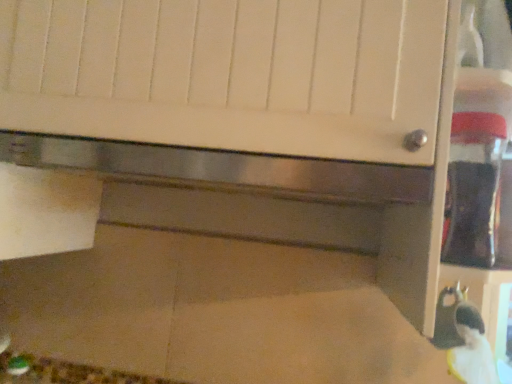
This screenshot has width=512, height=384. What do you see at coordinates (473, 189) in the screenshot?
I see `transparent plastic bottle at right` at bounding box center [473, 189].

Find the location of a particular element. transparent plastic bottle at right is located at coordinates (473, 189).

Where is `transparent plastic bottle at right`? The width and height of the screenshot is (512, 384). transparent plastic bottle at right is located at coordinates (473, 189).